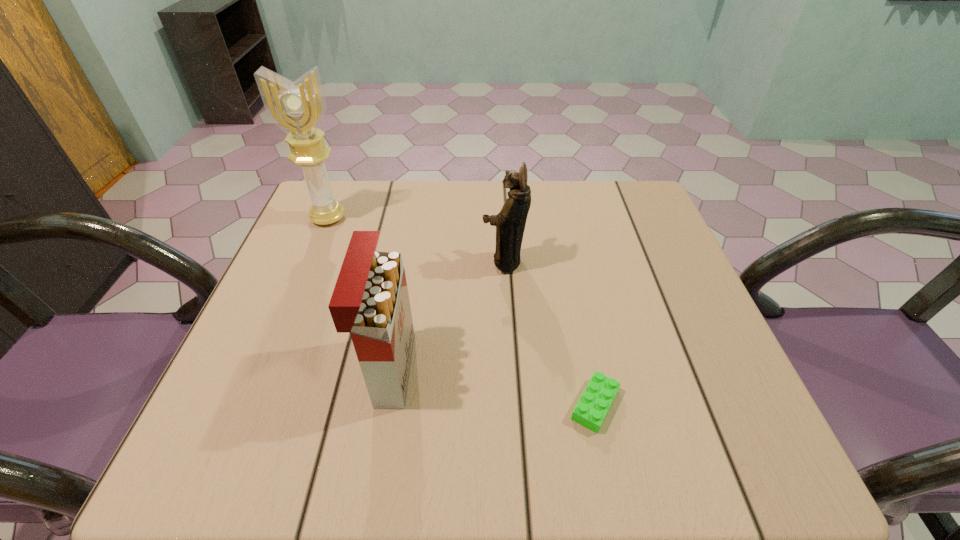
In the image, there is a desktop. What are the coordinates of `free space at the right edge` in the screenshot? It's located at (643, 291).

This screenshot has height=540, width=960. In the image, there is a desktop. Identify the location of vacant space at the far left corner. (308, 206).

Where is `blank area at the near left corner`? blank area at the near left corner is located at coordinates (265, 458).

You are a GUI agent. You are given a task and a screenshot of the screen. Output one action in this format:
    pyautogui.click(x=<x>, y=<y>)
    Task: Click on the vacant space at the far right corner of the desktop
    This screenshot has height=540, width=960.
    Given the screenshot: What is the action you would take?
    pyautogui.click(x=616, y=201)

Find the location of a particular element. Image resolution: width=960 pixels, height=540 pixels. vacant area that lies between the award and the third object from left to right is located at coordinates (416, 240).

At what (x,y) coordinates should I click in order to perform the action: click on free space between the third object from right to left and the rightmost object. Please return your answer as a coordinate pair (x, y). The width and height of the screenshot is (960, 540). Looking at the image, I should click on (492, 387).

This screenshot has height=540, width=960. In order to click on empty space between the shortest object and the second object from right to left in this screenshot , I will do `click(549, 333)`.

This screenshot has height=540, width=960. Identify the location of vacant area that lies between the second object from right to left and the tallest object. (416, 240).

Locate an element on the screen. This screenshot has width=960, height=540. free area in between the third object from left to right and the third object from right to left is located at coordinates (447, 315).

The image size is (960, 540). Find the location of `free space between the rightmost object and the second object from right to left`. free space between the rightmost object and the second object from right to left is located at coordinates (549, 333).